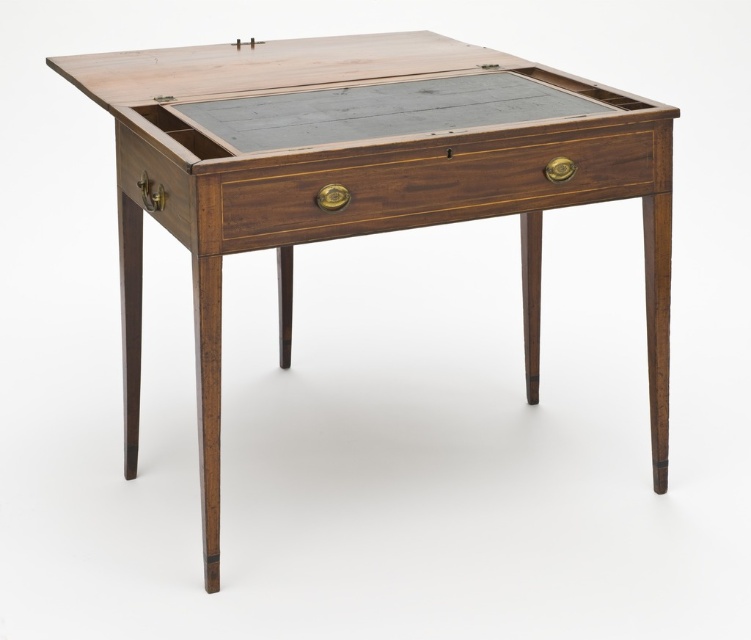
Is mahogany wood table at center to the left of mahogany drawer at center from the viewer's perspective?

Yes, mahogany wood table at center is to the left of mahogany drawer at center.

Can you confirm if mahogany wood table at center is bigger than mahogany drawer at center?

Yes.

Between point (505, 173) and point (347, 234), which one is positioned in front?

Point (347, 234) is more forward.

Where is `mahogany wood table at center`? This screenshot has width=751, height=640. mahogany wood table at center is located at coordinates (382, 170).

The image size is (751, 640). What are the coordinates of `mahogany drawer at center` in the screenshot? It's located at (436, 188).

Based on the photo, does mahogany drawer at center appear on the right side of mahogany wood drawer at left?

Yes, mahogany drawer at center is to the right of mahogany wood drawer at left.

Is point (379, 172) positioned before point (131, 195)?

Yes.

The image size is (751, 640). In order to click on mahogany drawer at center in this screenshot , I will do `click(436, 188)`.

Which is above, mahogany wood table at center or mahogany wood drawer at left?

mahogany wood drawer at left is above.

The width and height of the screenshot is (751, 640). I want to click on mahogany wood table at center, so click(x=382, y=170).